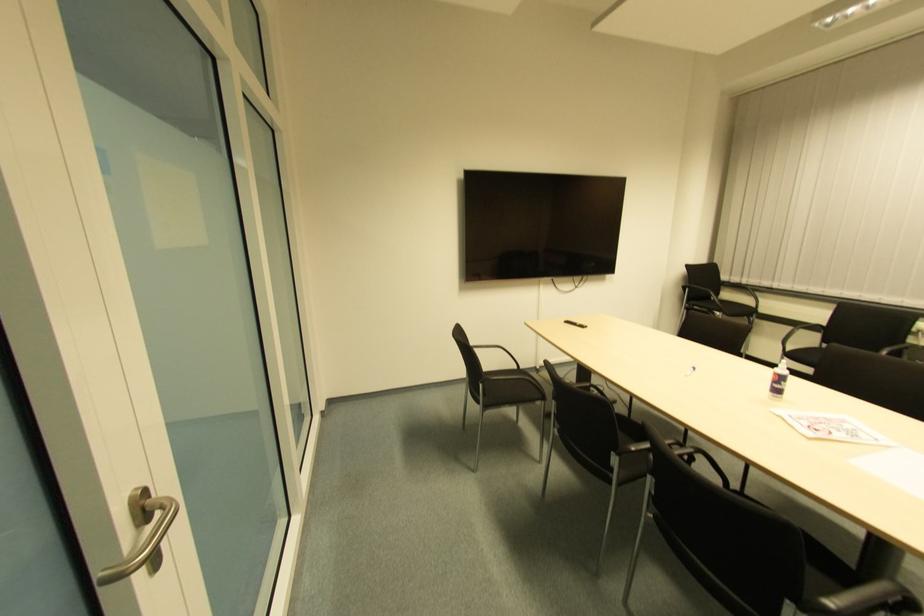
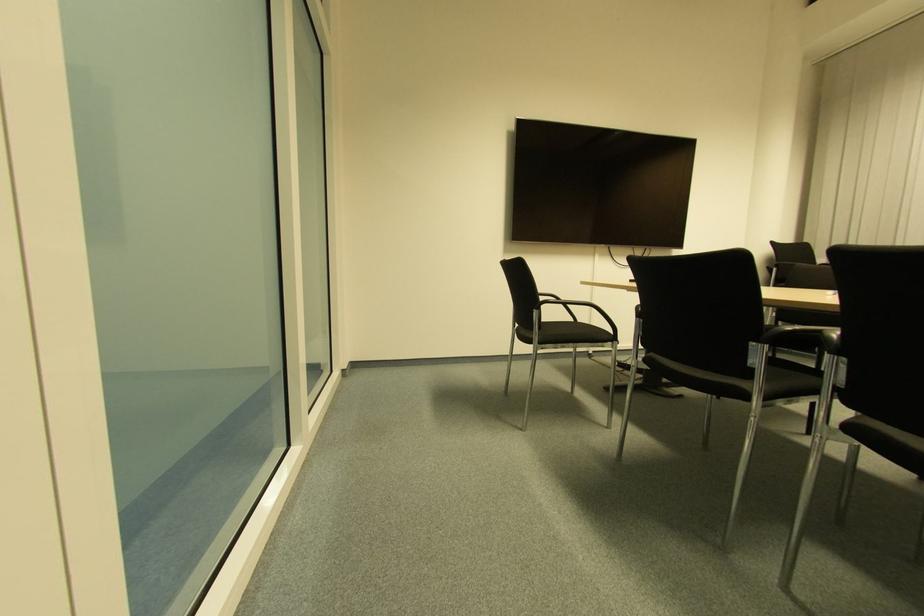
Question: The images are taken continuously from a first-person perspective. In which direction are you moving?

Choices:
 (A) Left
 (B) Right
 (C) Forward
 (D) Backward

Answer: (C)